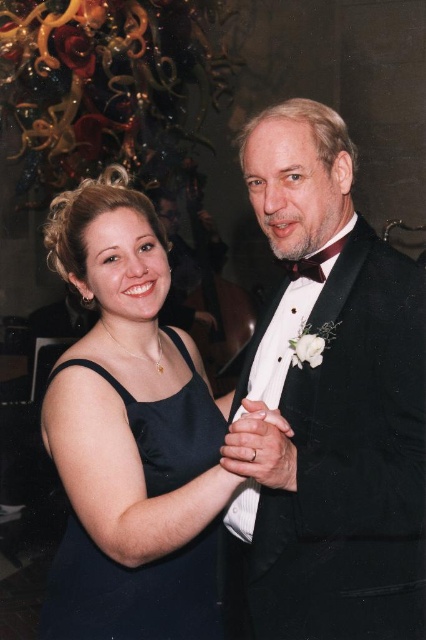
Question: Which point is farther to the camera?

Choices:
 (A) satin black dress at center
 (B) bow tie at center
 (C) black satin tuxedo at right

Answer: (B)

Question: Does satin black dress at center lie behind bow tie at center?

Choices:
 (A) yes
 (B) no

Answer: (B)

Question: Considering the real-world distances, which object is farthest from the black satin tuxedo at right?

Choices:
 (A) bow tie at center
 (B) satin black dress at center

Answer: (B)

Question: Does black satin tuxedo at right have a lesser width compared to bow tie at center?

Choices:
 (A) yes
 (B) no

Answer: (B)

Question: Which of the following is the closest to the observer?

Choices:
 (A) bow tie at center
 (B) black satin tuxedo at right
 (C) satin black dress at center

Answer: (B)

Question: Can you confirm if satin black dress at center is positioned above bow tie at center?

Choices:
 (A) no
 (B) yes

Answer: (A)